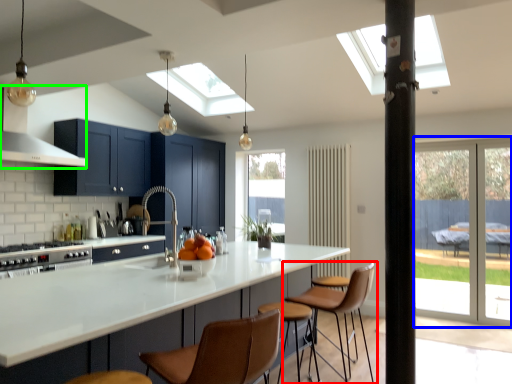
Question: Estimate the real-world distances between objects in this image. Which object is closer to chair (highlighted by a red box), screen door (highlighted by a blue box) or exhaust hood (highlighted by a green box)?

Choices:
 (A) screen door
 (B) exhaust hood

Answer: (A)